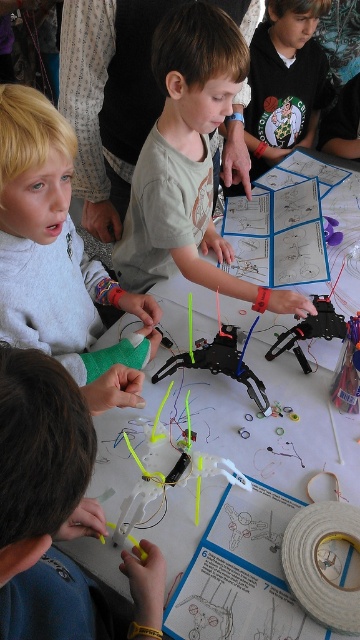
Looking at this image, you are a teacher observing the children working on their drone models. You notice two children wearing the matte green shirt at center and the light gray sweater at upper left. Which child is wearing a larger clothing item?

The matte green shirt at center is bigger than the light gray sweater at upper left, so the child wearing the matte green shirt at center has the larger clothing item.